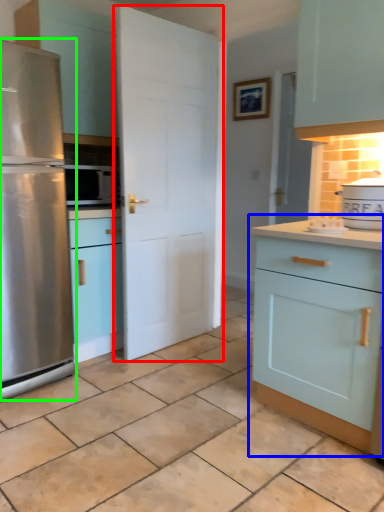
Question: Which object is the closest to the door (highlighted by a red box)? Choose among these: cabinetry (highlighted by a blue box) or refrigerator (highlighted by a green box).

Choices:
 (A) cabinetry
 (B) refrigerator

Answer: (B)